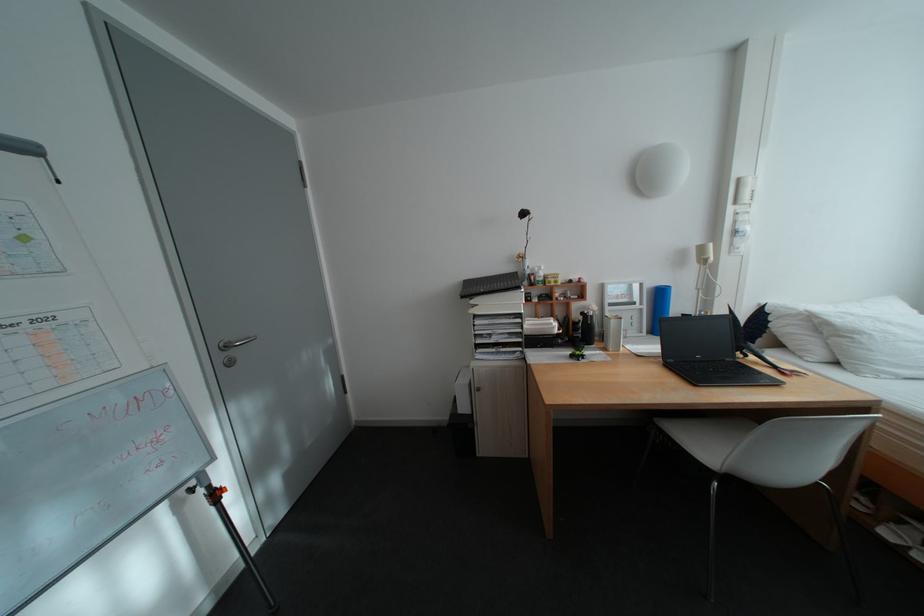
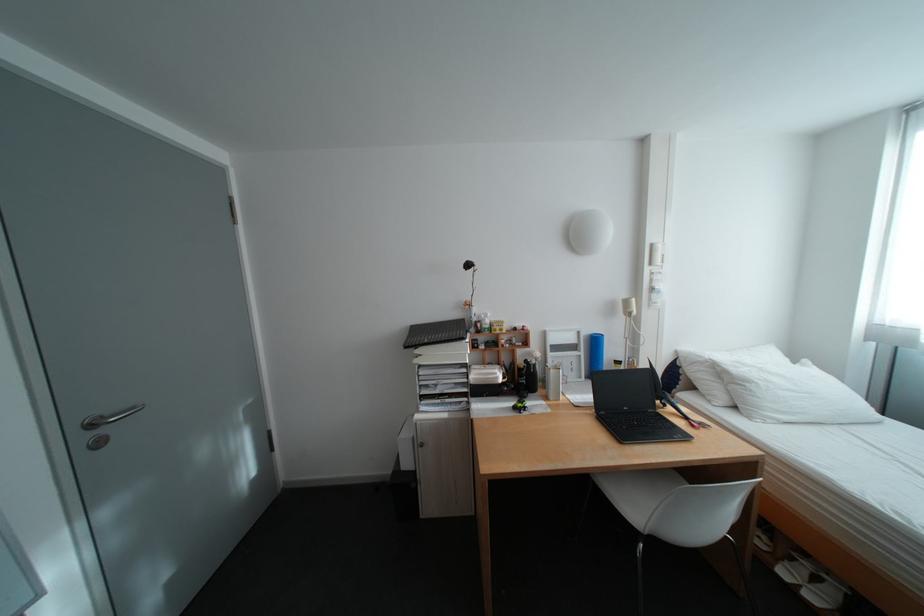
The point at (234, 358) is marked in the first image. Where is the corresponding point in the second image?

(99, 438)